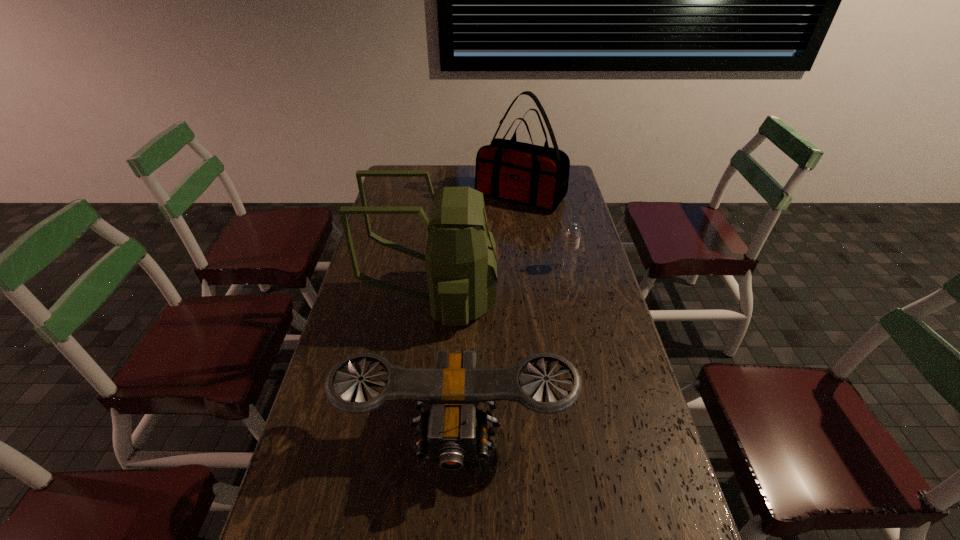
This screenshot has width=960, height=540. What are the coordinates of `duffel bag` in the screenshot? It's located at (537, 176).

The image size is (960, 540). In order to click on backpack in this screenshot , I will do `click(461, 264)`.

Where is `drone`? The image size is (960, 540). drone is located at coordinates (453, 426).

Identify the location of the nearest object. The width and height of the screenshot is (960, 540). (453, 426).

The height and width of the screenshot is (540, 960). Find the location of `the shortest object`. the shortest object is located at coordinates (570, 251).

Find the location of a particular element. The image size is (960, 540). vacant region located on the back of the duffel bag is located at coordinates (516, 165).

You are a GUI agent. You are given a task and a screenshot of the screen. Output one action in this format:
    pyautogui.click(x=<x>, y=<y>)
    Task: Click on the vacant space located on the front pocket of the backpack
    
    Given the screenshot: What is the action you would take?
    pyautogui.click(x=611, y=300)

Locate an element on the screen. Image resolution: width=960 pixels, height=540 pixels. vacant space located 0.170m on the front of the water bottle is located at coordinates (577, 306).

This screenshot has width=960, height=540. In order to click on object located at the far edge in this screenshot , I will do `click(537, 176)`.

Locate an element on the screen. This screenshot has height=540, width=960. backpack located in the left edge section of the desktop is located at coordinates (461, 264).